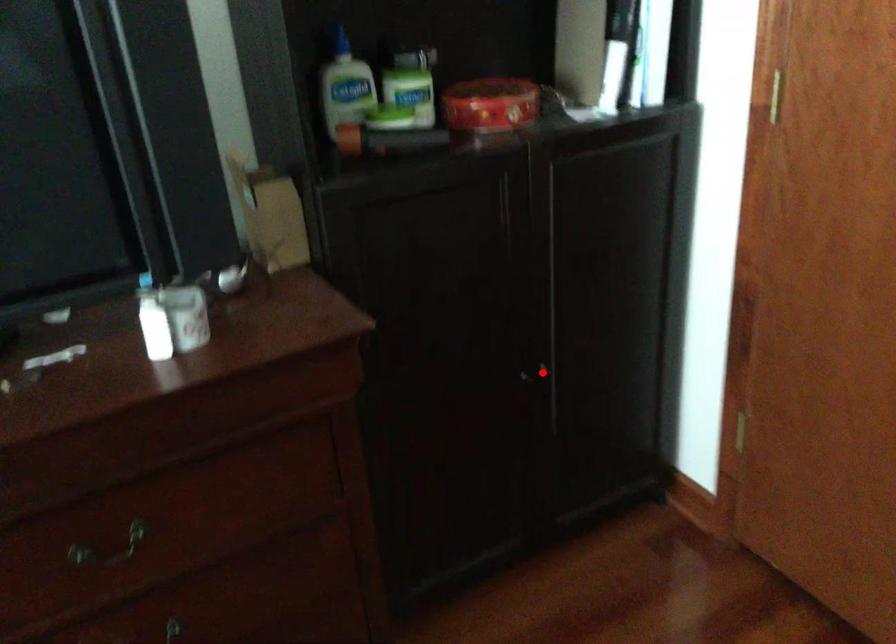
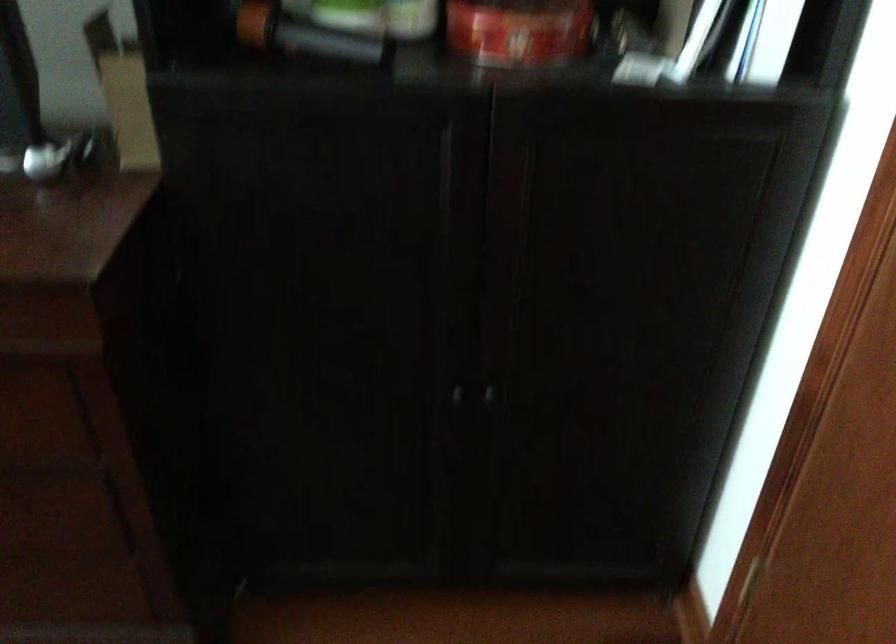
Locate, in the second image, the point that corresponds to the highlighted location in the first image.

(487, 395)